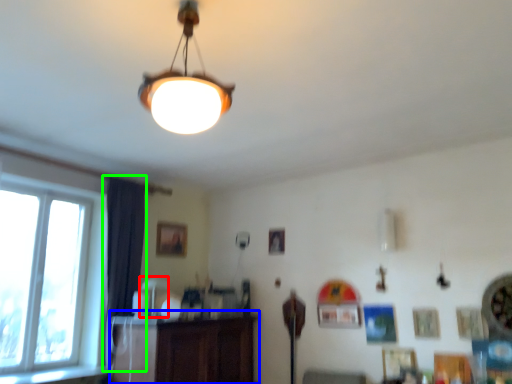
Question: Which object is the closest to the lamp (highlighted by a red box)? Choose among these: dresser (highlighted by a blue box) or curtain (highlighted by a green box).

Choices:
 (A) dresser
 (B) curtain

Answer: (B)